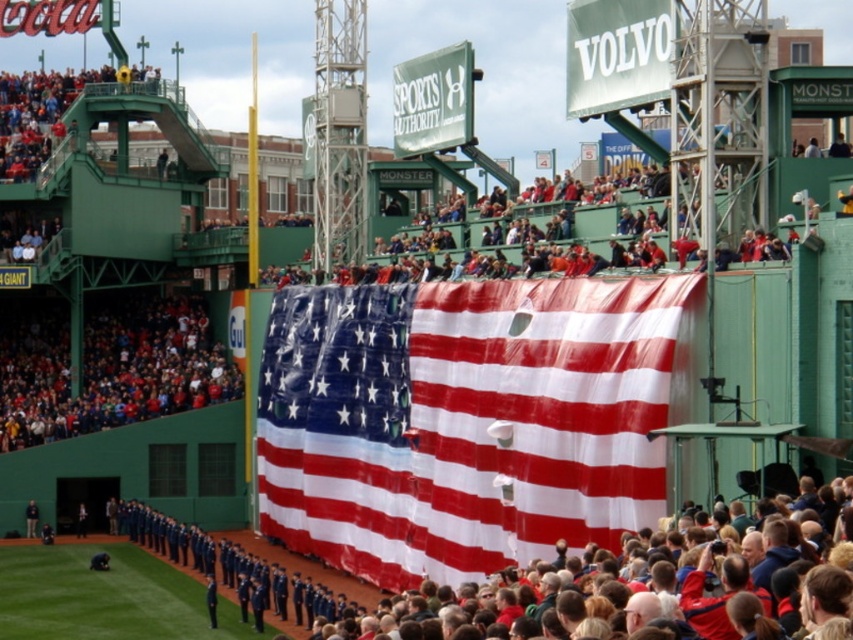
You are a photographer at the baseball stadium and want to capture a photo of the dark blue uniform at lower left without the polyester american flag at center blocking it. What should you do?

The polyester american flag at center is positioned over the dark blue uniform at lower left, so to avoid blocking, you should move your camera angle downward to capture the dark blue uniform at lower left below the flag.

You are a photographer positioned at the center of the baseball stadium outfield. You want to capture a photo that includes both the polyester american flag at center and the dark blue uniform at lower left. What is the minimum distance you need to move to ensure both are in frame?

The polyester american flag at center and dark blue uniform at lower left are 22.50 meters apart. To include both in the frame, you need to move back at least 22.50 meters from the closest object, ensuring both are within the camera view.

You are a photographer standing at the center of the baseball stadium outfield. You want to take a photo of both the American flag and the line of uniformed individuals. Which of the two points, point (535, 460) or point (36, 531), is closer to your current position?

Point (535, 460) is closer to the camera than point (36, 531), so it is closer to your current position.